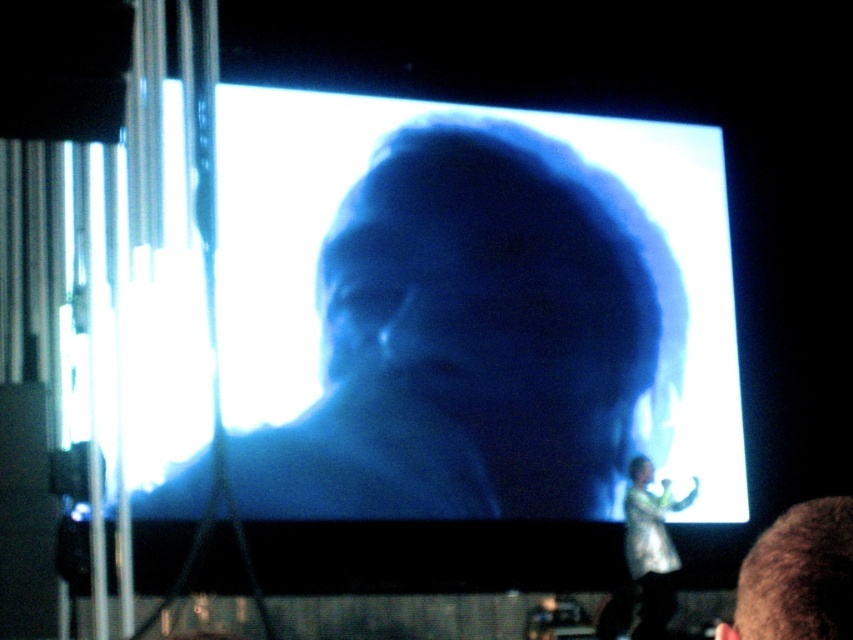
Is the position of blue matte face at center less distant than that of translucent white dress at lower right?

Yes, blue matte face at center is closer to the viewer.

Is blue matte face at center below translucent white dress at lower right?

Actually, blue matte face at center is above translucent white dress at lower right.

This screenshot has height=640, width=853. I want to click on blue matte face at center, so click(x=476, y=337).

This screenshot has height=640, width=853. Find the location of `blue matte face at center`. blue matte face at center is located at coordinates (476, 337).

Is brown hair at lower right smaller than translucent white dress at lower right?

Yes, brown hair at lower right is smaller than translucent white dress at lower right.

Between brown hair at lower right and translucent white dress at lower right, which one appears on the right side from the viewer's perspective?

From the viewer's perspective, translucent white dress at lower right appears more on the right side.

This screenshot has width=853, height=640. What are the coordinates of `brown hair at lower right` in the screenshot? It's located at (798, 577).

At what (x,y) coordinates should I click in order to perform the action: click on brown hair at lower right. Please return your answer as a coordinate pair (x, y). This screenshot has width=853, height=640. Looking at the image, I should click on (798, 577).

Is point (547, 384) in front of point (849, 548)?

No, (547, 384) is further to viewer.

Does blue matte face at center appear over brown hair at lower right?

No, blue matte face at center is not above brown hair at lower right.

At what (x,y) coordinates should I click in order to perform the action: click on blue matte face at center. Please return your answer as a coordinate pair (x, y). Looking at the image, I should click on (476, 337).